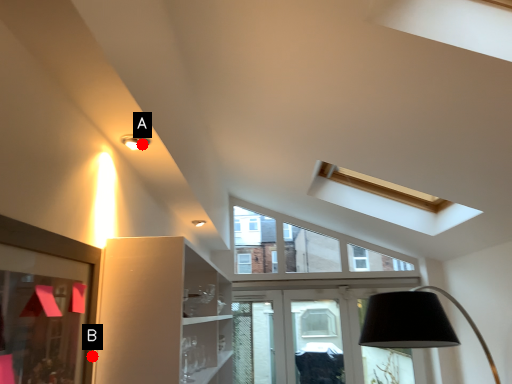
Question: Two points are circled on the image, labeled by A and B beside each circle. Which point is farther from the camera taking this photo?

Choices:
 (A) A is further
 (B) B is further

Answer: (A)